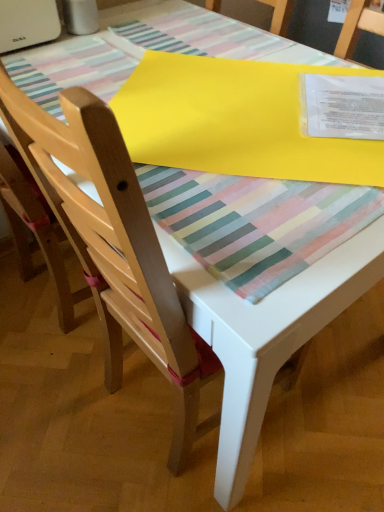
Where is `free space above yellow matte paper at upper center (from a real-world perspective)`? The image size is (384, 512). free space above yellow matte paper at upper center (from a real-world perspective) is located at coordinates (248, 109).